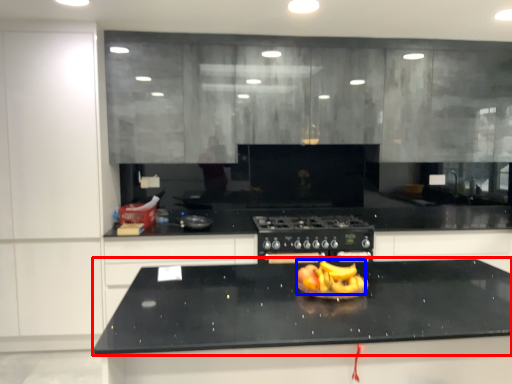
Question: Which object is further to the camera taking this photo, countertop (highlighted by a red box) or fruit dish (highlighted by a blue box)?

Choices:
 (A) countertop
 (B) fruit dish

Answer: (B)